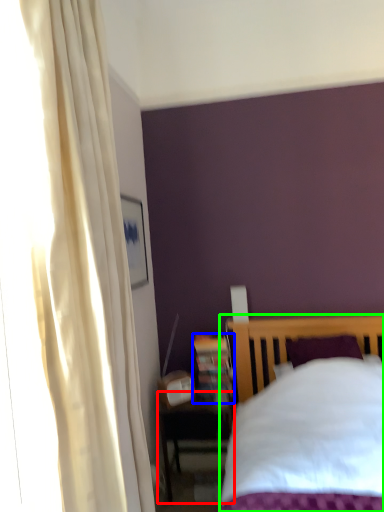
Question: Based on their relative distances, which object is nearer to nightstand (highlighted by a red box)? Choose from bookshelf (highlighted by a blue box) and bed (highlighted by a green box).

Choices:
 (A) bookshelf
 (B) bed

Answer: (A)